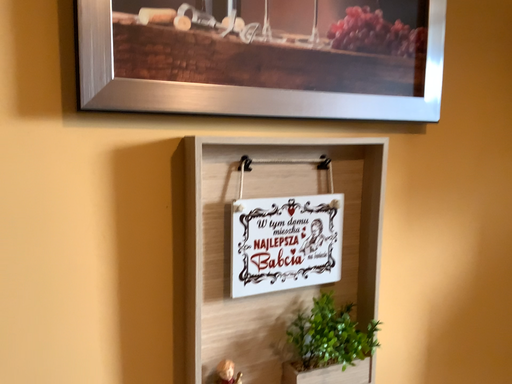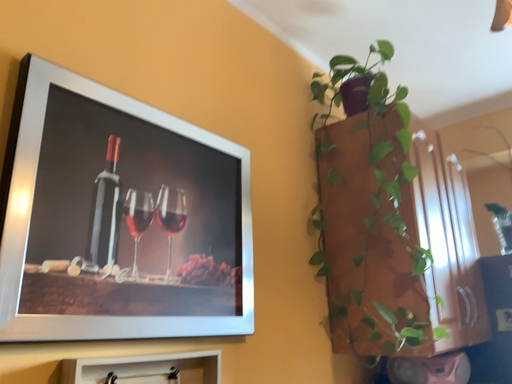
Question: Which way did the camera rotate in the video?

Choices:
 (A) rotated upward
 (B) rotated downward

Answer: (A)